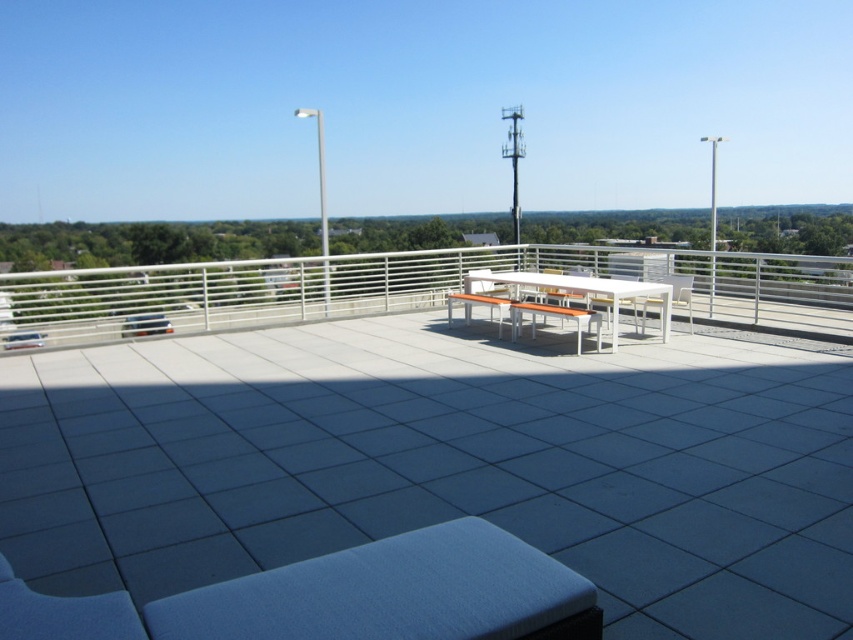
Is white tile deck at center taller than white matte picnic table at center?

Yes, white tile deck at center is taller than white matte picnic table at center.

Is point (416, 264) behind point (663, 333)?

Yes, it is.

Is point (608, 276) positioned after point (543, 284)?

Yes, it is behind point (543, 284).

Locate an element on the screen. The height and width of the screenshot is (640, 853). white tile deck at center is located at coordinates (416, 445).

Between white tile deck at center and white metal railing at upper center, which one appears on the right side from the viewer's perspective?

Positioned to the right is white metal railing at upper center.

Is white tile deck at center above white metal railing at upper center?

No, white tile deck at center is not above white metal railing at upper center.

Does point (312, 525) come in front of point (805, 269)?

That is True.

The width and height of the screenshot is (853, 640). I want to click on white tile deck at center, so click(x=416, y=445).

Can you confirm if white metal railing at upper center is positioned to the left of white plastic chair at center?

Yes, white metal railing at upper center is to the left of white plastic chair at center.

Is the position of white metal railing at upper center less distant than that of white plastic chair at center?

Yes, it is.

What do you see at coordinates (416, 289) in the screenshot?
I see `white metal railing at upper center` at bounding box center [416, 289].

I want to click on white metal railing at upper center, so click(416, 289).